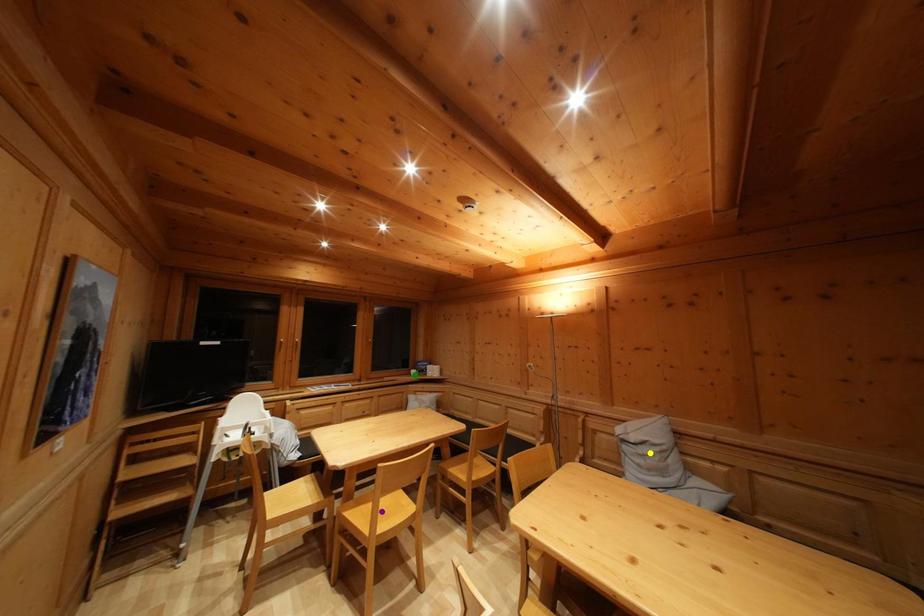
Order these from nearest to farthest:
purple point | green point | yellow point

purple point
yellow point
green point